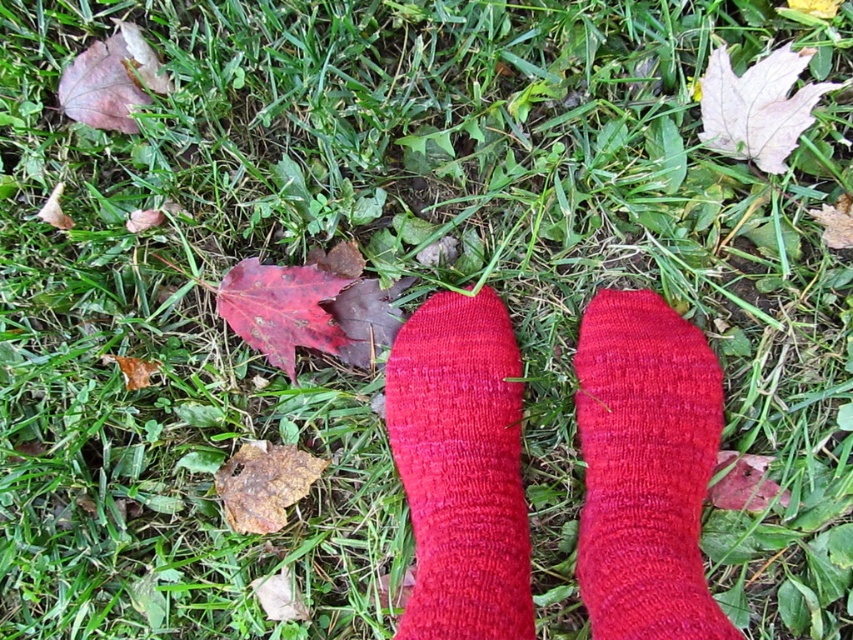
You are standing at the origin point of the image. Where is the knitted red sock at center located relative to your position?

The knitted red sock at center is located at point 0.733 on the x axis and 0.757 on the y axis relative to the origin point of the image.

You are a photographer trying to capture both the knitted red sock at center and the matte red sock at center in a single shot. Given that your camera has a minimum focus distance of 10 inches, will you be able to take the photo without moving the socks closer together?

The distance between the knitted red sock at center and the matte red sock at center is 7.28 inches, which is less than the camera minimum focus distance of 10 inches. Therefore, you can take the photo without moving the socks closer together.

You are designing a display for a sock shop and want to place the knitted red sock at center and matte red sock at center side by side. Based on their heights, which sock should you place on the shelf first to ensure they both fit properly?

The knitted red sock at center is not as tall as matte red sock at center, so you should place the matte red sock at center first to ensure there is enough space for both.